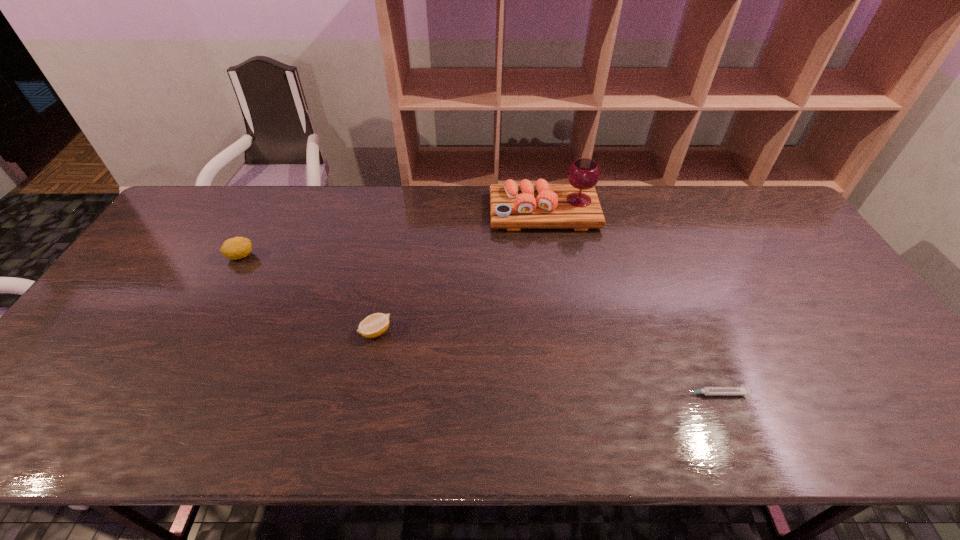
You are a GUI agent. You are given a task and a screenshot of the screen. Output one action in this format:
    pyautogui.click(x=<x>, y=<y>)
    Task: Click on the free region located 0.110m on the back of the second object from left to right
    The height and width of the screenshot is (540, 960).
    Given the screenshot: What is the action you would take?
    pyautogui.click(x=384, y=289)

You are a GUI agent. You are given a task and a screenshot of the screen. Output one action in this format:
    pyautogui.click(x=<x>, y=<y>)
    Task: Click on the vacant space situated at the needle end of the rightmost object
    
    Given the screenshot: What is the action you would take?
    pyautogui.click(x=603, y=394)

At what (x,y) coordinates should I click in order to perform the action: click on free region located 0.340m at the needle end of the rightmost object. Please return your answer as a coordinate pair (x, y). Looking at the image, I should click on (534, 394).

Image resolution: width=960 pixels, height=540 pixels. I want to click on free region located at the needle end of the rightmost object, so click(x=556, y=394).

Identify the location of object situated at the far edge. (576, 205).

In the image, there is a desktop. At what (x,y) coordinates should I click in order to perform the action: click on free space at the far edge. Please return your answer as a coordinate pair (x, y). This screenshot has width=960, height=540. Looking at the image, I should click on (282, 186).

Image resolution: width=960 pixels, height=540 pixels. I want to click on vacant space at the near edge of the desktop, so click(x=602, y=419).

Identify the location of vacant space at the left edge. (72, 375).

In the image, there is a desktop. Identify the location of free space at the right edge. Image resolution: width=960 pixels, height=540 pixels. (790, 269).

The image size is (960, 540). In order to click on vacant space in between the platter and the left lemon in this screenshot , I will do `click(393, 234)`.